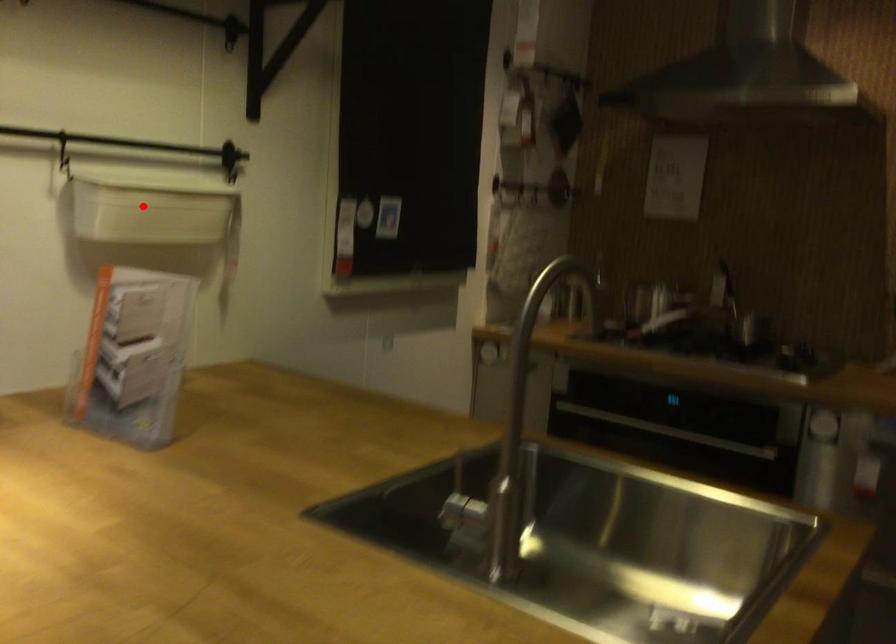
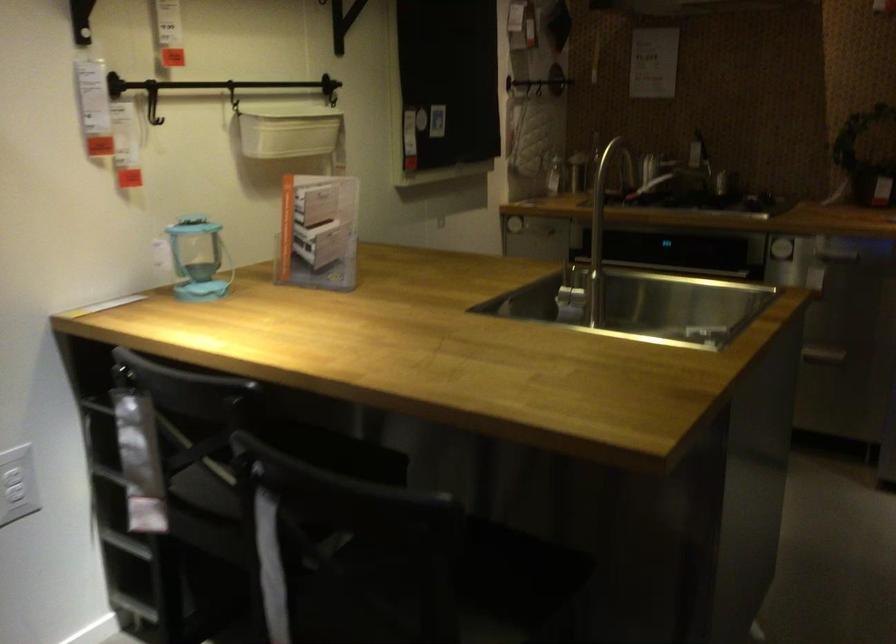
Question: I am providing you with two images of the same scene from different viewpoints. Image1 has a red point marked. In image2, the corresponding 3D location appears at what relative position? Reply with the corresponding letter.

Choices:
 (A) Closer
 (B) Farther

Answer: (B)